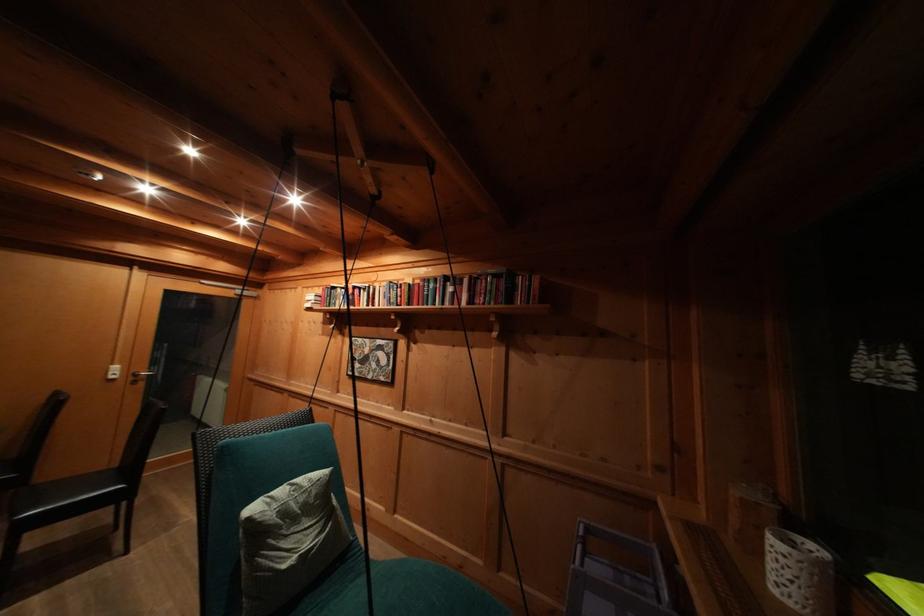
Where is `silver door handle`? The height and width of the screenshot is (616, 924). silver door handle is located at coordinates (140, 376).